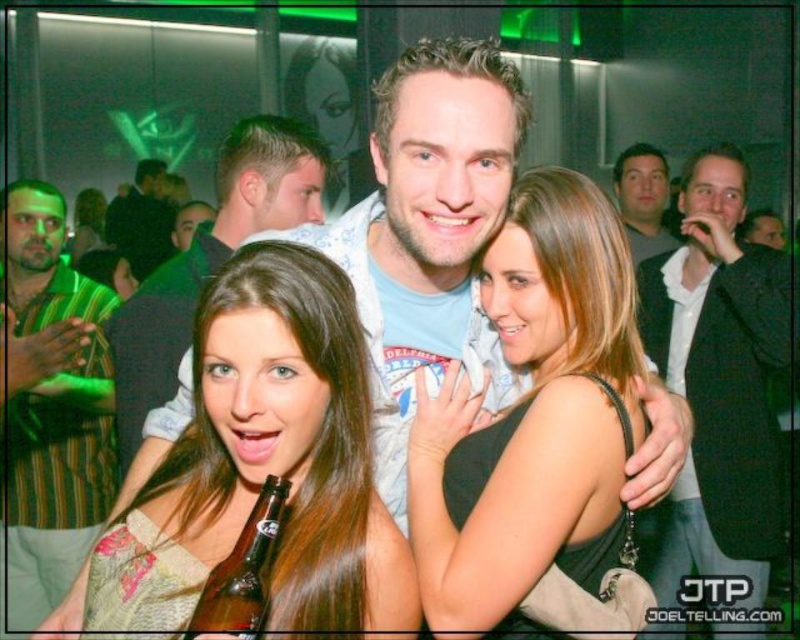
Question: Among these objects, which one is farthest from the camera?

Choices:
 (A) smooth brown hair at center
 (B) striped shirt at left
 (C) blue cotton t-shirt at center

Answer: (B)

Question: Is smooth brown hair at center below matte blue shirt at center?

Choices:
 (A) no
 (B) yes

Answer: (B)

Question: Where is smooth brown hair at center located in relation to black leather jacket at upper center in the image?

Choices:
 (A) right
 (B) left

Answer: (A)

Question: From the image, what is the correct spatial relationship of black satin dress at center in relation to striped shirt at left?

Choices:
 (A) left
 (B) right

Answer: (B)

Question: Estimate the real-world distances between objects in this image. Which object is farther from the black satin dress at center?

Choices:
 (A) black textured suit at right
 (B) blue cotton t-shirt at center
 (C) matte blue shirt at center
 (D) dark suit jacket at upper right

Answer: (D)

Question: Considering the real-world distances, which object is farthest from the brown glass bottle at center?

Choices:
 (A) black satin dress at center
 (B) smooth brown hair at center

Answer: (A)